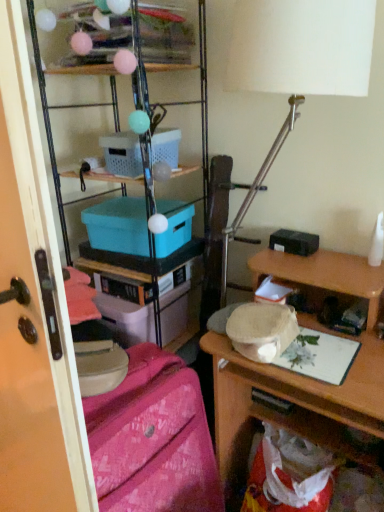
The width and height of the screenshot is (384, 512). What do you see at coordinates (153, 439) in the screenshot? I see `pink fabric suitcase at lower left` at bounding box center [153, 439].

In order to face transparent plastic screen door at left, should I rotate leftwards or rightwards?

Turn left by 26.071 degrees to look at transparent plastic screen door at left.

Find the location of `matte plastic storage at upper left, the 2th shelf viewed from the top`. matte plastic storage at upper left, the 2th shelf viewed from the top is located at coordinates (65, 108).

Can you confirm if wooden desk at right is thinner than transparent plastic screen door at left?

No.

Consider the image. Is wooden desk at right oriented towards transparent plastic screen door at left?

No.

Is wooden desk at right not close to transparent plastic screen door at left?

No, wooden desk at right is not far from transparent plastic screen door at left.

From a real-world perspective, who is located higher, white plastic box at upper center, the first box when ordered from top to bottom, or wooden desk at right?

In real-world perspective, white plastic box at upper center, the first box when ordered from top to bottom, is above.

What's the angular difference between white plastic box at upper center, the first box when ordered from top to bottom, and wooden desk at right's facing directions?

They differ by 2.34 degrees in their facing directions.

Is white plastic box at upper center, the first box when ordered from top to bottom, turned away from wooden desk at right?

No, white plastic box at upper center, the first box when ordered from top to bottom, is not facing the opposite direction of wooden desk at right.

Considering the relative positions of white plastic box at upper center, the first box when ordered from top to bottom, and wooden desk at right in the image provided, is white plastic box at upper center, the first box when ordered from top to bottom, in front of wooden desk at right?

No, white plastic box at upper center, the first box when ordered from top to bottom, is further to the viewer.

Does matte plastic storage at upper left, the 1th shelf positioned from the bottom, have a larger size compared to translucent plastic shelf at upper center, which ranks as the first shelf in top-to-bottom order?

Yes.

Is matte plastic storage at upper left, the 1th shelf positioned from the bottom, in contact with translucent plastic shelf at upper center, the second shelf when ordered from bottom to top?

No, matte plastic storage at upper left, the 1th shelf positioned from the bottom, is not touching translucent plastic shelf at upper center, the second shelf when ordered from bottom to top.

Is matte plastic storage at upper left, the 1th shelf positioned from the bottom, inside the boundaries of translucent plastic shelf at upper center, the second shelf when ordered from bottom to top, or outside?

matte plastic storage at upper left, the 1th shelf positioned from the bottom, is not inside translucent plastic shelf at upper center, the second shelf when ordered from bottom to top, it's outside.

From the image's perspective, which is below, matte plastic storage at upper left, the 1th shelf positioned from the bottom, or translucent plastic shelf at upper center, which ranks as the first shelf in top-to-bottom order?

matte plastic storage at upper left, the 1th shelf positioned from the bottom.

From the picture: Does matte plastic storage at upper left, the 1th shelf positioned from the bottom, appear on the left side of white matte table lamp at upper center?

Indeed, matte plastic storage at upper left, the 1th shelf positioned from the bottom, is positioned on the left side of white matte table lamp at upper center.

Would you say matte plastic storage at upper left, the 1th shelf positioned from the bottom, is inside or outside white matte table lamp at upper center?

matte plastic storage at upper left, the 1th shelf positioned from the bottom, cannot be found inside white matte table lamp at upper center.

Consider the image. Is matte plastic storage at upper left, the 1th shelf positioned from the bottom, in front of white matte table lamp at upper center?

No, the depth of matte plastic storage at upper left, the 1th shelf positioned from the bottom, is greater than that of white matte table lamp at upper center.

Is pink fabric suitcase at lower left inside or outside of matte plastic storage at upper left, the 2th shelf viewed from the top?

pink fabric suitcase at lower left is spatially situated outside matte plastic storage at upper left, the 2th shelf viewed from the top.

In terms of height, does pink fabric suitcase at lower left look taller or shorter compared to matte plastic storage at upper left, the 1th shelf positioned from the bottom?

Considering their sizes, pink fabric suitcase at lower left has less height than matte plastic storage at upper left, the 1th shelf positioned from the bottom.

How many degrees apart are the facing directions of pink fabric suitcase at lower left and matte plastic storage at upper left, the 2th shelf viewed from the top?

There is a 85.7-degree angle between the facing directions of pink fabric suitcase at lower left and matte plastic storage at upper left, the 2th shelf viewed from the top.

Which is more to the right, pink fabric suitcase at lower left or matte plastic storage at upper left, the 1th shelf positioned from the bottom?

Positioned to the right is pink fabric suitcase at lower left.

Is point (2, 449) positioned in front of point (112, 455)?

No, (2, 449) is further to viewer.

From a real-world perspective, is transparent plastic screen door at left above or below pink fabric suitcase at lower left?

From a real-world perspective, transparent plastic screen door at left is physically above pink fabric suitcase at lower left.

Does transparent plastic screen door at left appear on the right side of pink fabric suitcase at lower left?

Incorrect, transparent plastic screen door at left is not on the right side of pink fabric suitcase at lower left.

How many degrees apart are the facing directions of wooden desk at right and teal plastic box at center, which is counted as the 2th box, starting from the top?

→ 11.8 degrees.

Considering the sizes of objects wooden desk at right and teal plastic box at center, the 1th box from the bottom, in the image provided, who is smaller, wooden desk at right or teal plastic box at center, the 1th box from the bottom,?

teal plastic box at center, the 1th box from the bottom, is smaller.

From the image's perspective, who appears lower, wooden desk at right or teal plastic box at center, which is counted as the 2th box, starting from the top?

wooden desk at right appears lower in the image.

Considering the points (240, 447) and (128, 249), which point is in front, point (240, 447) or point (128, 249)?

Point (128, 249)

At what (x,y) coordinates should I click in order to perform the action: click on desk on the right of transparent plastic screen door at left. Please return your answer as a coordinate pair (x, y). Looking at the image, I should click on (295, 373).

Find the location of a particular element. the 1st box to the left of the wooden desk at right, counting from the anchor's position is located at coordinates (122, 154).

Estimate the real-world distances between objects in this image. Which object is closer to transparent plastic screen door at left, white plastic box at upper center, the 2th box from the bottom, or pink fabric suitcase at lower left?

pink fabric suitcase at lower left.

Which object lies nearer to the anchor point translucent plastic shelf at upper center, the second shelf when ordered from bottom to top, white plastic box at upper center, the first box when ordered from top to bottom, or teal plastic box at center, the 1th box from the bottom?

white plastic box at upper center, the first box when ordered from top to bottom, is closer to translucent plastic shelf at upper center, the second shelf when ordered from bottom to top.

Which object lies nearer to the anchor point transparent plastic screen door at left, wooden desk at right or teal plastic box at center, which is counted as the 2th box, starting from the top?

wooden desk at right lies closer to transparent plastic screen door at left than the other object.

Looking at the image, which one is located further to white plastic box at upper center, the first box when ordered from top to bottom, translucent plastic shelf at upper center, the second shelf when ordered from bottom to top, or transparent plastic screen door at left?

transparent plastic screen door at left is positioned further to the anchor white plastic box at upper center, the first box when ordered from top to bottom.

From the image, which object appears to be farther from transparent plastic screen door at left, translucent plastic shelf at upper center, which ranks as the first shelf in top-to-bottom order, or white matte table lamp at upper center?

translucent plastic shelf at upper center, which ranks as the first shelf in top-to-bottom order, is positioned further to the anchor transparent plastic screen door at left.

Based on their spatial positions, is pink fabric suitcase at lower left or transparent plastic screen door at left further from white matte table lamp at upper center?

transparent plastic screen door at left lies further to white matte table lamp at upper center than the other object.

Estimate the real-world distances between objects in this image. Which object is further from teal plastic box at center, the 1th box from the bottom, white plastic box at upper center, the first box when ordered from top to bottom, or pink fabric suitcase at lower left?

pink fabric suitcase at lower left.

From the image, which object appears to be nearer to wooden desk at right, white plastic box at upper center, the first box when ordered from top to bottom, or white matte table lamp at upper center?

The object closer to wooden desk at right is white matte table lamp at upper center.

The height and width of the screenshot is (512, 384). Find the location of `table lamp that lies between white plastic box at upper center, the 2th box from the bottom, and wooden desk at right from top to bottom`. table lamp that lies between white plastic box at upper center, the 2th box from the bottom, and wooden desk at right from top to bottom is located at coordinates (296, 64).

You are a GUI agent. You are given a task and a screenshot of the screen. Output one action in this format:
    pyautogui.click(x=<x>, y=<y>)
    Task: Click on the table lamp between translucent plastic shelf at upper center, the second shelf when ordered from bottom to top, and transparent plastic screen door at left vertically
    The image size is (384, 512).
    Given the screenshot: What is the action you would take?
    pyautogui.click(x=296, y=64)

Where is `desk between teal plastic box at center, which is counted as the 2th box, starting from the top, and pink fabric suitcase at lower left vertically`? desk between teal plastic box at center, which is counted as the 2th box, starting from the top, and pink fabric suitcase at lower left vertically is located at coordinates 295,373.

Locate an element on the screen. The image size is (384, 512). box located between transparent plastic screen door at left and teal plastic box at center, the 1th box from the bottom, in the depth direction is located at coordinates (122, 154).